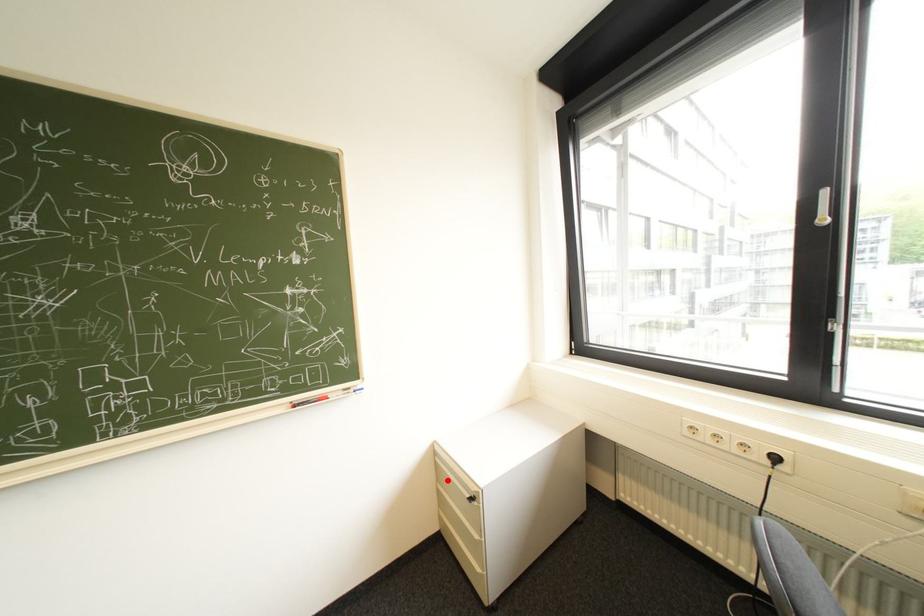
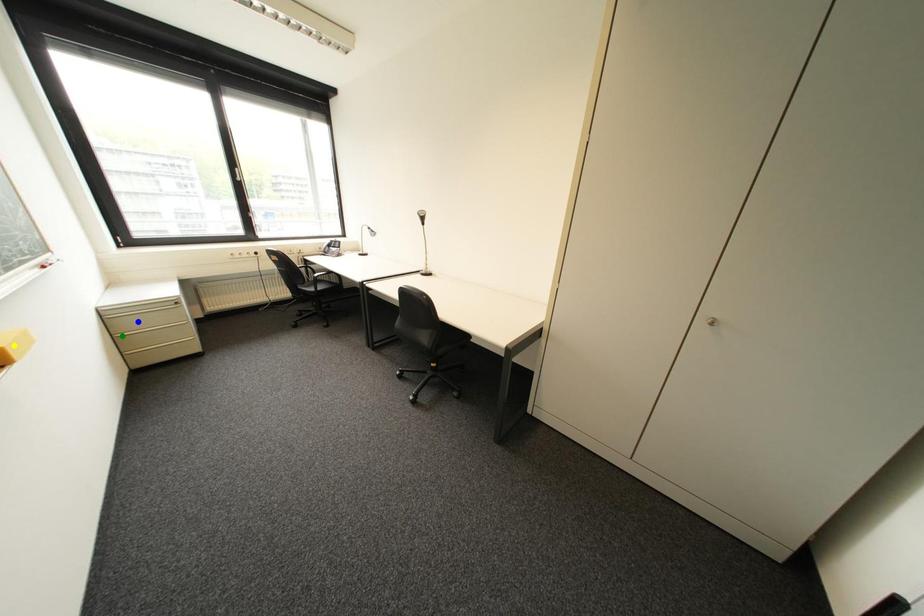
Question: I am providing you with two images of the same scene from different viewpoints. A red point is marked on the first image. You are given multiple points on the second image. Can you choose the point in image 2 that corresponds to the point in image 1?

Choices:
 (A) blue point
 (B) green point
 (C) yellow point

Answer: (B)